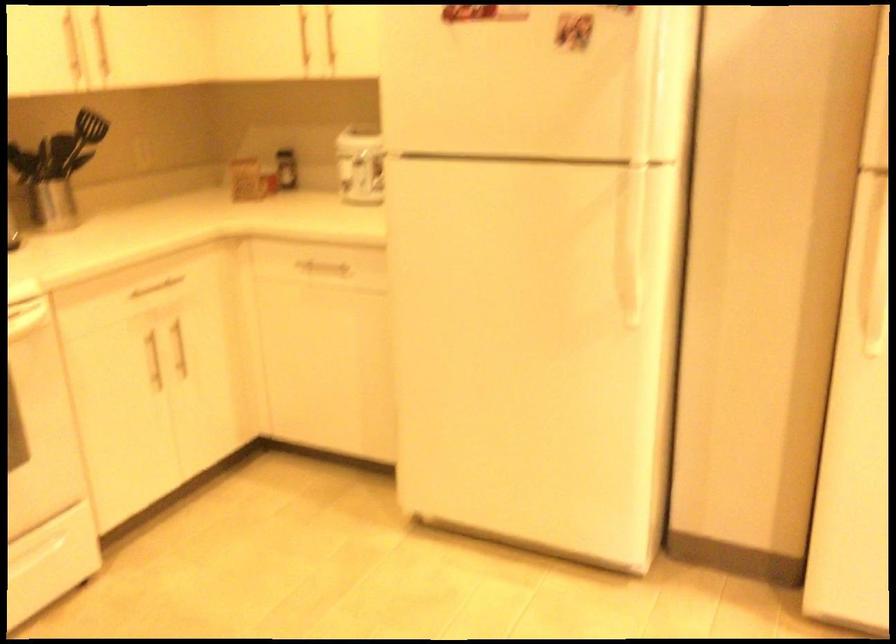
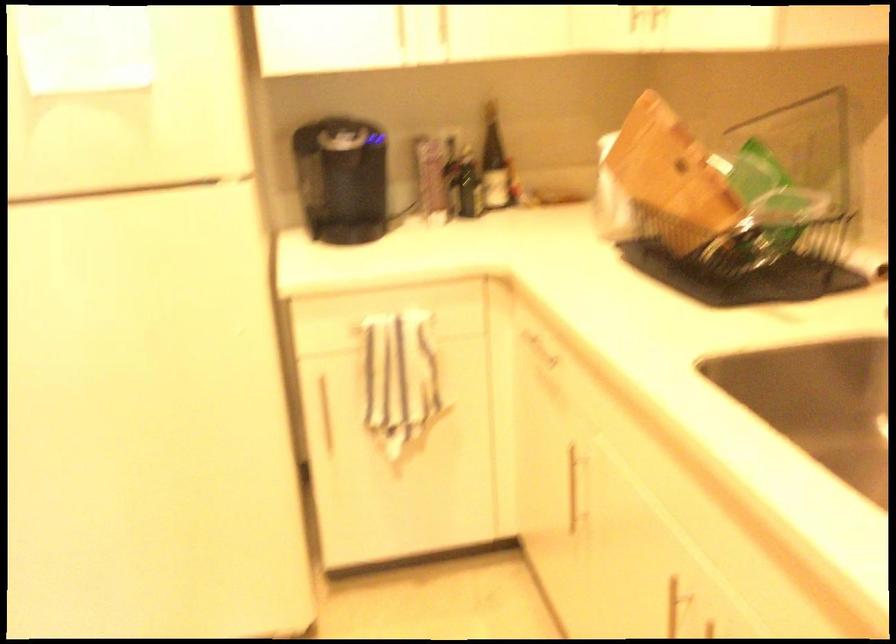
Question: The images are taken continuously from a first-person perspective. In which direction is your viewpoint rotating?

Choices:
 (A) Left
 (B) Right
 (C) Up
 (D) Down

Answer: (B)